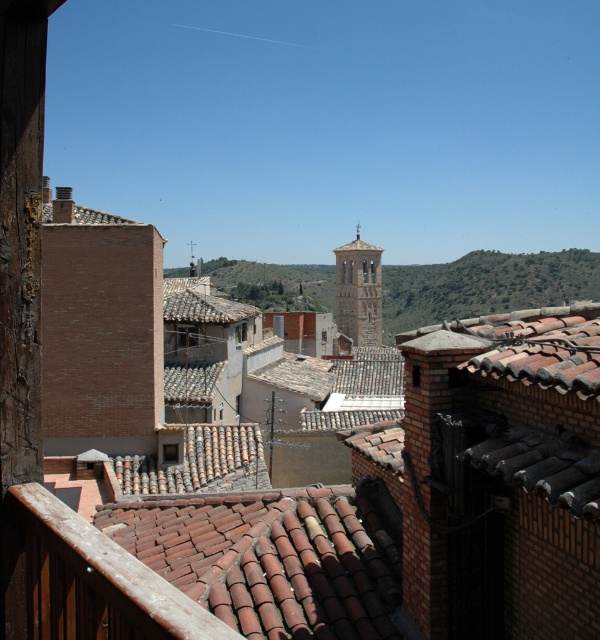
Question: Does terracotta clay tiles at center have a greater width compared to green grassy hillside at center?

Choices:
 (A) no
 (B) yes

Answer: (A)

Question: Considering the real-world distances, which object is farthest from the green grassy hillside at center?

Choices:
 (A) light brown stone bell tower at center
 (B) terracotta clay tiles at center

Answer: (B)

Question: Which point appears closest to the camera in this image?

Choices:
 (A) (411, 301)
 (B) (310, 506)
 (C) (376, 337)

Answer: (B)

Question: Among these objects, which one is nearest to the camera?

Choices:
 (A) green grassy hillside at center
 (B) light brown stone bell tower at center
 (C) terracotta clay tiles at center

Answer: (C)

Question: Considering the relative positions of terracotta clay tiles at center and light brown stone bell tower at center in the image provided, where is terracotta clay tiles at center located with respect to light brown stone bell tower at center?

Choices:
 (A) left
 (B) right

Answer: (A)

Question: Considering the relative positions of green grassy hillside at center and light brown stone bell tower at center in the image provided, where is green grassy hillside at center located with respect to light brown stone bell tower at center?

Choices:
 (A) below
 (B) above

Answer: (B)